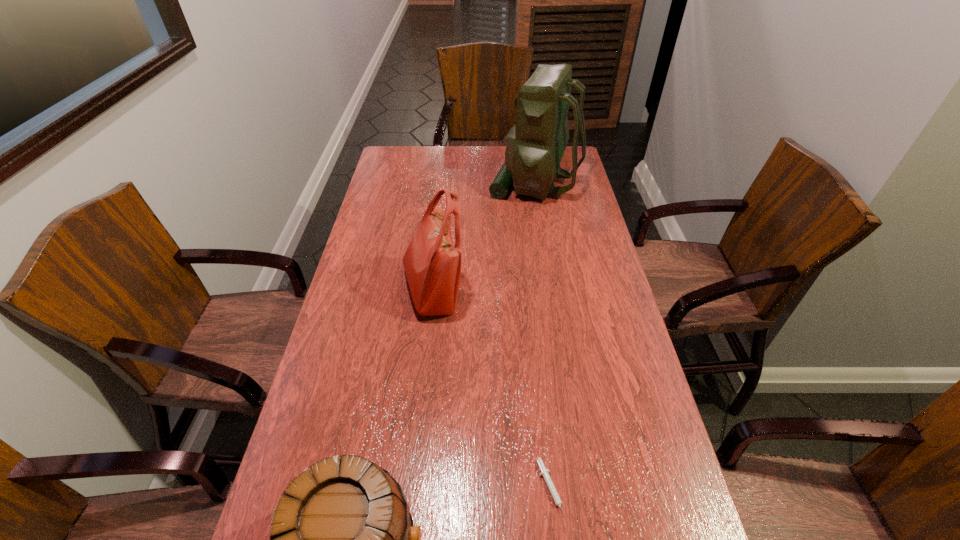
Where is `backpack`? backpack is located at coordinates (535, 145).

Where is `the tallest object`? Image resolution: width=960 pixels, height=540 pixels. the tallest object is located at coordinates (535, 145).

Find the location of a particular element. This screenshot has width=960, height=540. the second tallest object is located at coordinates (432, 263).

In order to click on the third nearest object in this screenshot , I will do `click(432, 263)`.

Locate an element on the screen. Image resolution: width=960 pixels, height=540 pixels. syringe is located at coordinates click(545, 473).

Locate an element on the screen. This screenshot has height=540, width=960. vacant space situated 0.050m on the front of the backpack with visible pockets is located at coordinates (476, 183).

The width and height of the screenshot is (960, 540). In order to click on vacant space located on the front of the backpack with visible pockets in this screenshot , I will do `click(474, 183)`.

I want to click on free space located on the front of the backpack with visible pockets, so click(443, 183).

The image size is (960, 540). What are the coordinates of `vacant area located 0.130m on the front-facing side of the third nearest object` in the screenshot? It's located at (506, 291).

Image resolution: width=960 pixels, height=540 pixels. I want to click on free location located 0.120m on the right of the syringe, so click(618, 490).